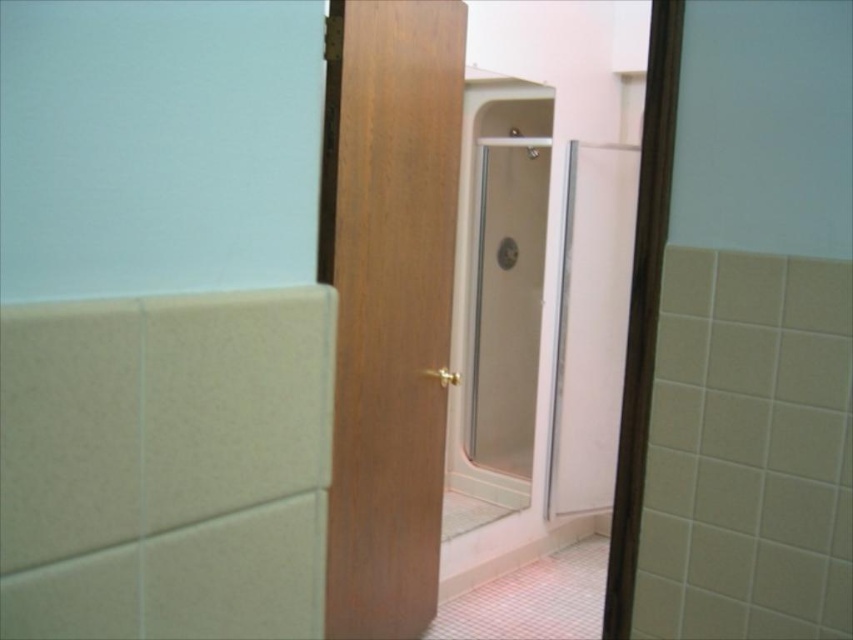
You are designing a bathroom layout and need to ensure accessibility for a wheelchair user. The wheelchair has a height of 45 cm. The wooden door at center and clear glass shower door at center are both in your way. Which door should you adjust first to allow the wheelchair to pass through comfortably?

The wooden door at center is located below the clear glass shower door at center. Since the wooden door is lower, adjusting it first would ensure the wheelchair can pass under it comfortably.

You are standing in the bathroom and want to enter the shower area. Which door should you open first, the wooden door at center or the clear glass shower door at center?

You should open the wooden door at center first because it is closer to you than the clear glass shower door at center, so you need to pass through it to reach the shower area.

You are standing in the bathroom and want to reach a specific point marked at coordinates point (447, 156). If your current position is 5 feet away from the shower area, can you walk towards the point without crossing into the shower area?

The distance of point (447, 156) from viewer is 7.98 feet. Since you are currently 5 feet away from the shower area, you need to move an additional 2.98 feet towards the point to reach it, which may require entering the shower area depending on its layout.